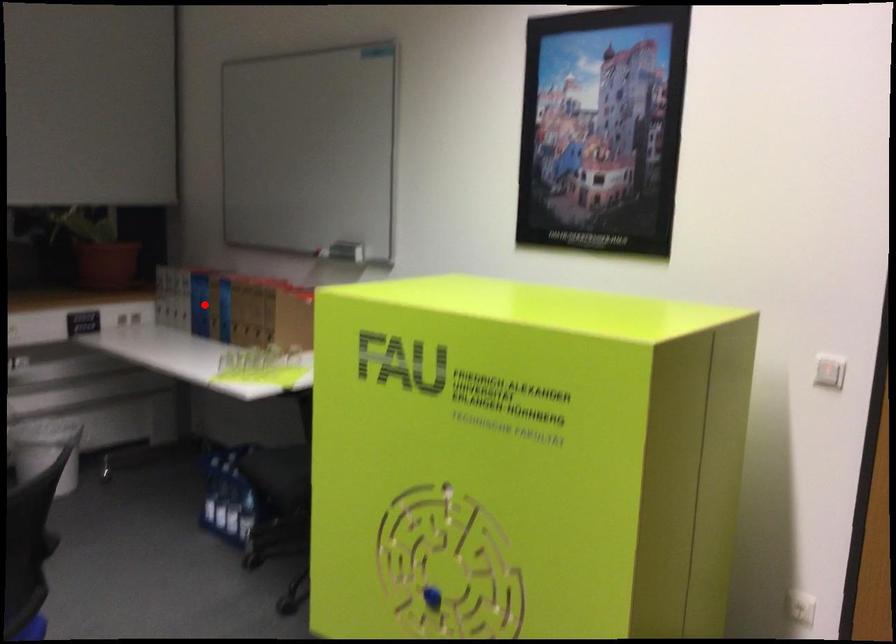
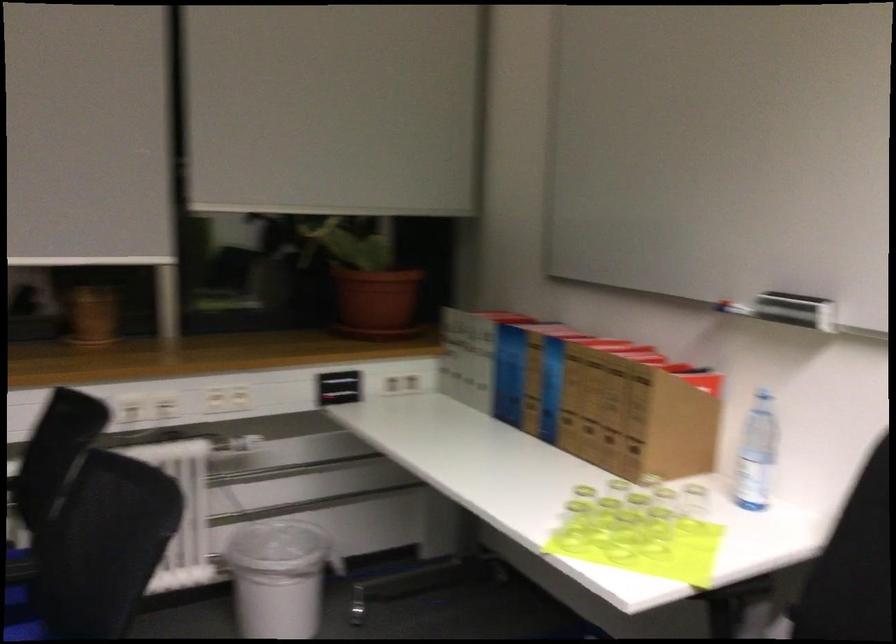
Question: I am providing you with two images of the same scene from different viewpoints. Image1 has a red point marked. In image2, the corresponding 3D location appears at what relative position? Reply with the corresponding letter.

Choices:
 (A) Closer
 (B) Farther

Answer: (A)